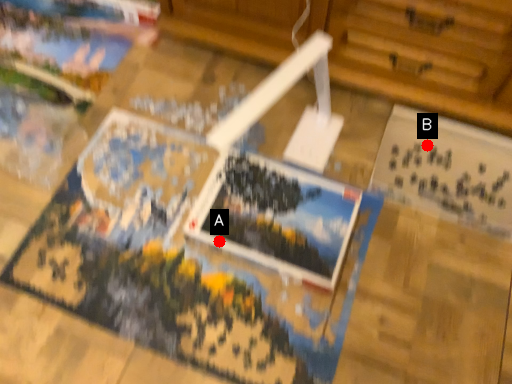
Question: Two points are circled on the image, labeled by A and B beside each circle. Which point is further to the camera?

Choices:
 (A) A is further
 (B) B is further

Answer: (B)